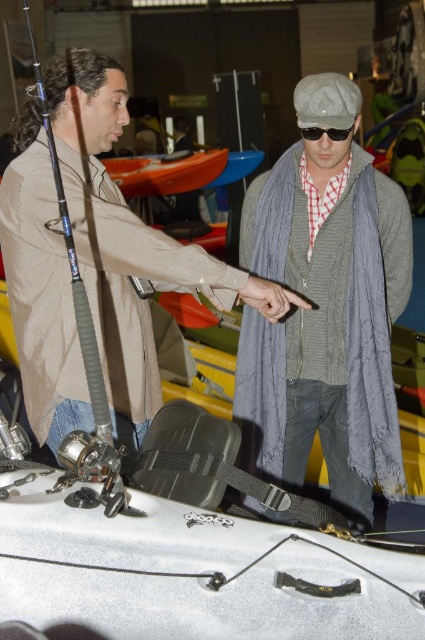
Does point (258, 444) come farther from viewer compared to point (316, 134)?

Yes, point (258, 444) is behind point (316, 134).

Can you confirm if gray knitted scarf at center is shorter than black matte sunglasses at center?

In fact, gray knitted scarf at center may be taller than black matte sunglasses at center.

Who is more distant from viewer, (362, 440) or (300, 131)?

Positioned behind is point (300, 131).

Locate an element on the screen. gray knitted scarf at center is located at coordinates (325, 305).

Is point (56, 252) less distant than point (348, 129)?

Yes, it is in front of point (348, 129).

Is matte gray scarf at center positioned behind black matte sunglasses at center?

No, matte gray scarf at center is closer to the viewer.

Does point (108, 394) come closer to viewer compared to point (337, 138)?

Yes, it is.

Identify the location of matte gray scarf at center. (127, 237).

Which of these two, matte gray scarf at center or blue matte fishing pole at left, stands shorter?

Standing shorter between the two is blue matte fishing pole at left.

Which is more to the right, matte gray scarf at center or blue matte fishing pole at left?

matte gray scarf at center

Image resolution: width=425 pixels, height=640 pixels. Find the location of `matte gray scarf at center`. matte gray scarf at center is located at coordinates (127, 237).